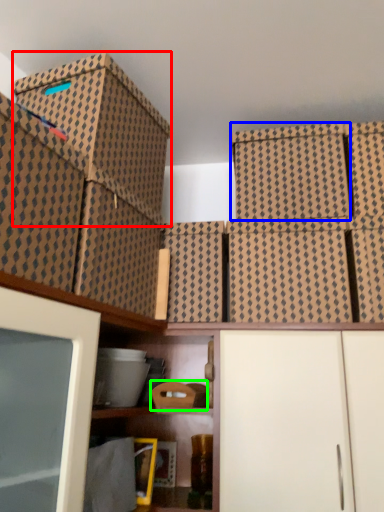
Question: Which is farther away from storage box (highlighted by a red box)? storage box (highlighted by a blue box) or storage box (highlighted by a green box)?

Choices:
 (A) storage box
 (B) storage box

Answer: (B)